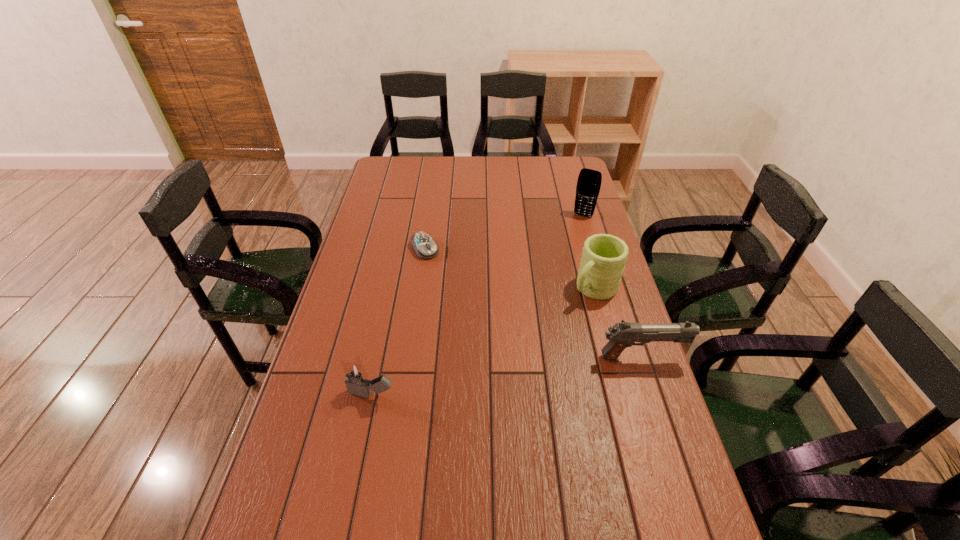
Where is `vacant point located between the gun and the second farthest object`? This screenshot has width=960, height=540. vacant point located between the gun and the second farthest object is located at coordinates (533, 303).

Identify the location of vacant space that is in between the tallest object and the nearest object. Image resolution: width=960 pixels, height=540 pixels. (x=478, y=304).

What are the coordinates of `vacant space that's between the third farthest object and the fourth nearest object` in the screenshot? It's located at (510, 269).

Where is `free spot between the shortest object and the fourth farthest object`? free spot between the shortest object and the fourth farthest object is located at coordinates (533, 303).

Locate an element on the screen. The width and height of the screenshot is (960, 540). the closest object relative to the fourth nearest object is located at coordinates (604, 256).

Find the location of a particular element. This screenshot has width=960, height=540. the second closest object to the computer mouse is located at coordinates (357, 383).

Where is `vacant area in the image that satisfies the following two spatial constraints: 1. on the front side of the fourth farthest object; 2. in the direction the computer mouse is aimed`? vacant area in the image that satisfies the following two spatial constraints: 1. on the front side of the fourth farthest object; 2. in the direction the computer mouse is aimed is located at coordinates (409, 357).

Find the location of a particular element. The height and width of the screenshot is (540, 960). vacant region that satisfies the following two spatial constraints: 1. on the back side of the igniter; 2. on the right side of the tallest object is located at coordinates (409, 215).

Image resolution: width=960 pixels, height=540 pixels. I want to click on blank space that satisfies the following two spatial constraints: 1. on the front side of the cellular telephone; 2. in the direction the gun is aimed, so click(625, 357).